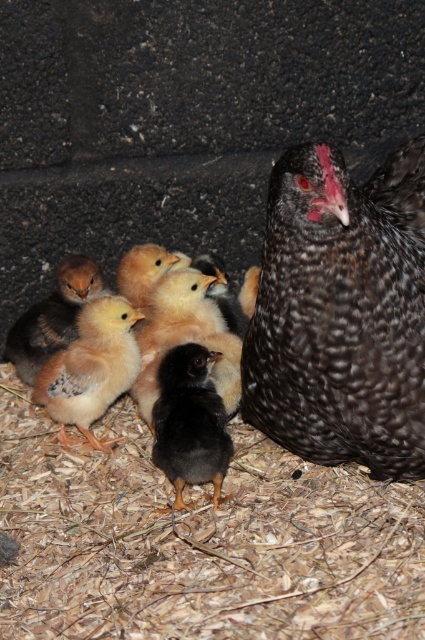
Is point (155, 422) less distant than point (47, 346)?

Yes, point (155, 422) is in front of point (47, 346).

Who is more distant from viewer, (178, 355) or (27, 358)?

The point (27, 358) is behind.

Which is in front, point (218, 422) or point (31, 349)?

Positioned in front is point (218, 422).

Identify the location of black matte chick at center. The width and height of the screenshot is (425, 640). (189, 422).

Is speckled feathered hen at center below yellow downy chick at left?

No, speckled feathered hen at center is not below yellow downy chick at left.

Which is behind, point (331, 212) or point (50, 298)?

Point (50, 298)

Locate an element on the screen. speckled feathered hen at center is located at coordinates (342, 312).

Find the location of a particular element. This screenshot has height=640, width=425. speckled feathered hen at center is located at coordinates (342, 312).

Is speckled feathered hen at center taller than light yellow downy chick at center?

Yes, speckled feathered hen at center is taller than light yellow downy chick at center.

Is speckled feathered hen at center positioned in front of light yellow downy chick at center?

Yes, it is in front of light yellow downy chick at center.

Which is behind, point (345, 349) or point (65, 396)?

Point (65, 396)

Identify the location of speckled feathered hen at center. (342, 312).